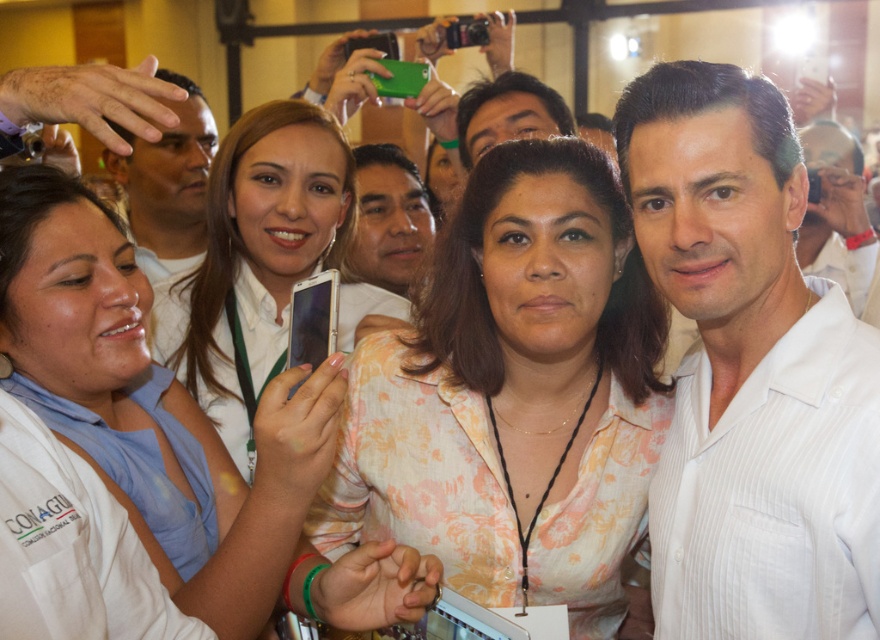
You are organizing a group photo and need to arrange two people wearing white shirts at the center. The white pinstriped shirt at center and the white fabric shirt at center. Which shirt should be placed on the left to ensure the narrower one is on the left side?

The white pinstriped shirt at center has a smaller width than the white fabric shirt at center. To place the narrower one on the left, the white pinstriped shirt at center should be positioned on the left side.

Consider the image. You are at a social gathering and want to take a photo of the matte white shirt at center without the matte white phone at center appearing in the frame. The camera you have can focus on objects within 3 feet. Is this possible?

The matte white phone at center is 3.73 feet away from the matte white shirt at center. Since your camera can focus within 3 feet, the distance between them is greater than the camera range, so you cannot take a photo of the matte white shirt at center without the matte white phone at center appearing in the frame.